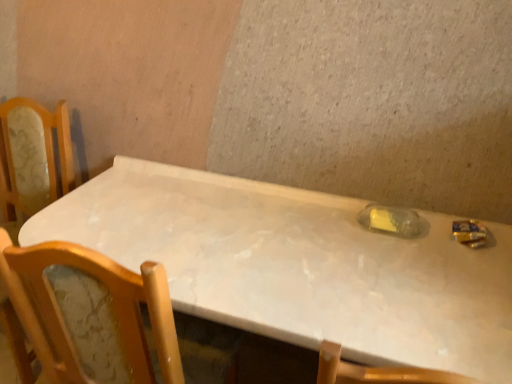
Locate an element on the screen. This screenshot has height=384, width=512. free region on the left part of translucent plastic bottle at center is located at coordinates (341, 226).